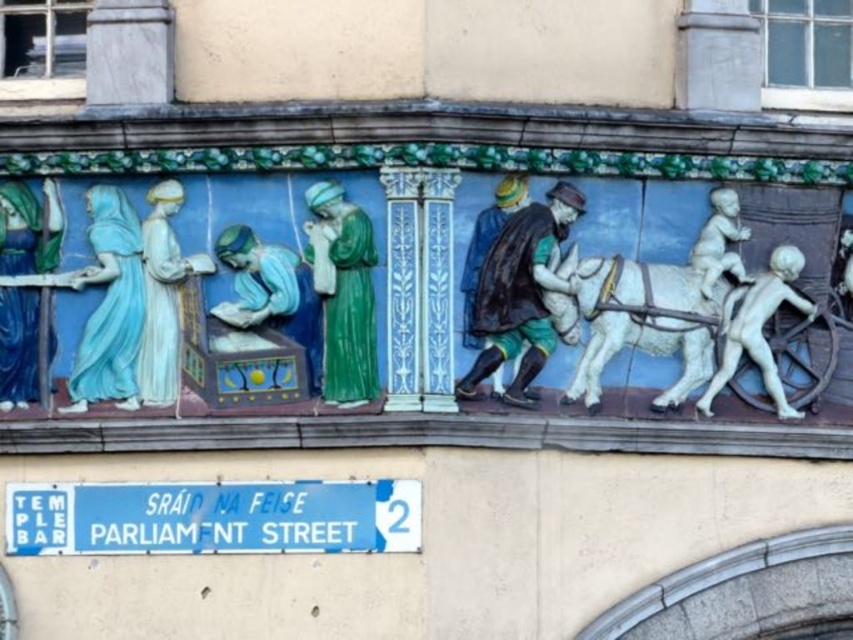
Does matte blue fabric at left have a lesser width compared to smooth white baby at center?

Correct, matte blue fabric at left's width is less than smooth white baby at center's.

Which is more to the left, matte blue fabric at left or smooth white baby at center?

matte blue fabric at left

You are a GUI agent. You are given a task and a screenshot of the screen. Output one action in this format:
    pyautogui.click(x=<x>, y=<y>)
    Task: Click on the matte blue fabric at left
    
    Given the screenshot: What is the action you would take?
    pyautogui.click(x=109, y=305)

Image resolution: width=853 pixels, height=640 pixels. Find the location of `matte blue fabric at left`. matte blue fabric at left is located at coordinates (109, 305).

Who is positioned more to the right, white glossy horse at center or matte blue dress at upper left?

From the viewer's perspective, white glossy horse at center appears more on the right side.

Who is positioned more to the left, white glossy horse at center or matte blue dress at upper left?

From the viewer's perspective, matte blue dress at upper left appears more on the left side.

Locate an element on the screen. white glossy horse at center is located at coordinates pos(634,321).

Between matte blue robe at left and matte blue dress at upper left, which one is positioned higher?

Positioned higher is matte blue robe at left.

Where is `matte blue robe at left`? matte blue robe at left is located at coordinates (28, 228).